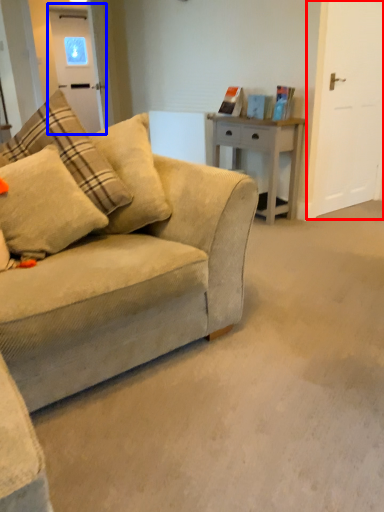
Question: Which object appears farthest to the camera in this image, glass door (highlighted by a red box) or glass door (highlighted by a blue box)?

Choices:
 (A) glass door
 (B) glass door

Answer: (B)